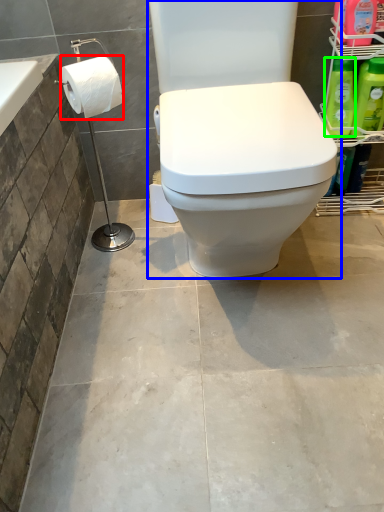
Question: Estimate the real-world distances between objects in this image. Which object is farther from toilet paper (highlighted by a red box), toilet (highlighted by a blue box) or cleaning product (highlighted by a green box)?

Choices:
 (A) toilet
 (B) cleaning product

Answer: (B)